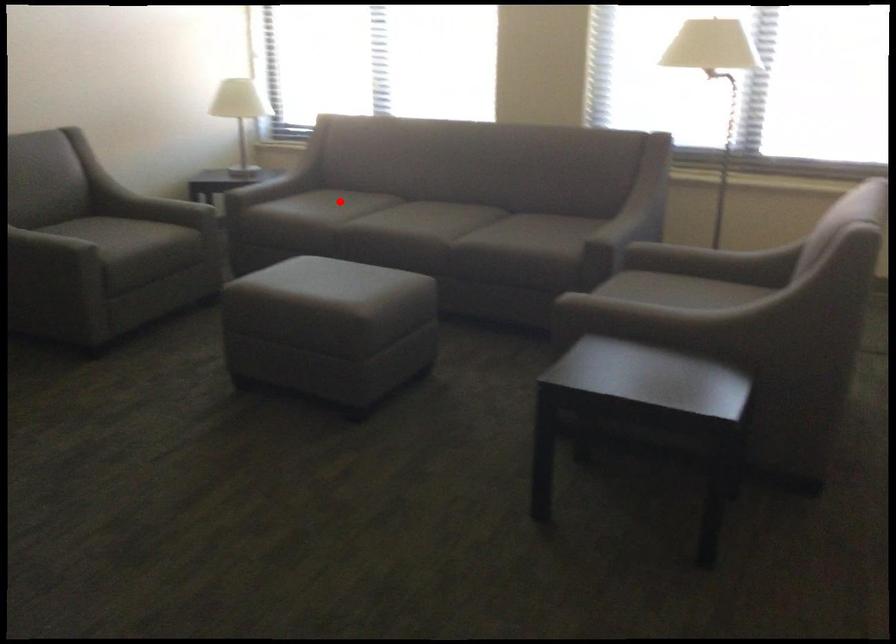
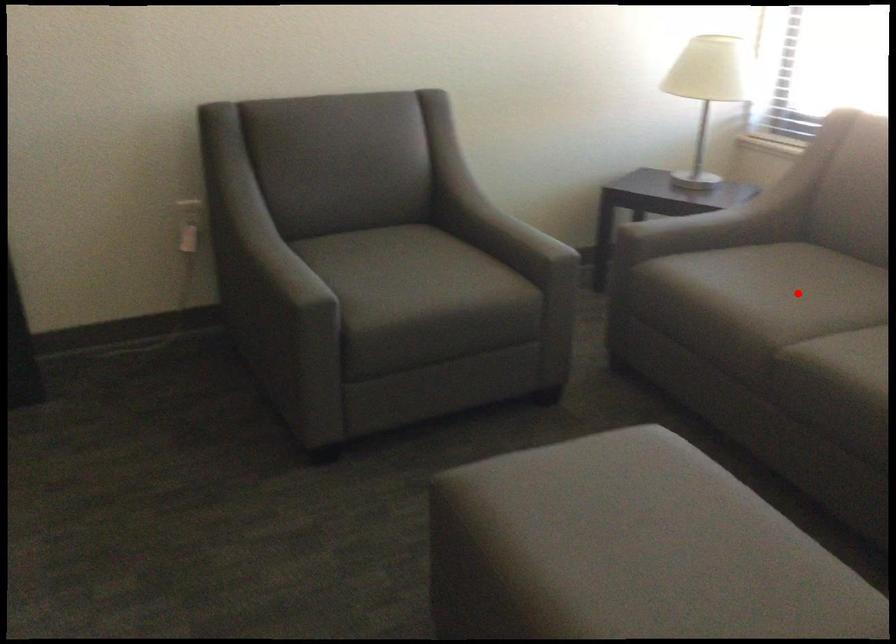
From the picture: I am providing you with two images of the same scene from different viewpoints. A red point is marked on the first image and another point is marked on the second image. Is the red point in image1 aligned with the point shown in image2?

Yes